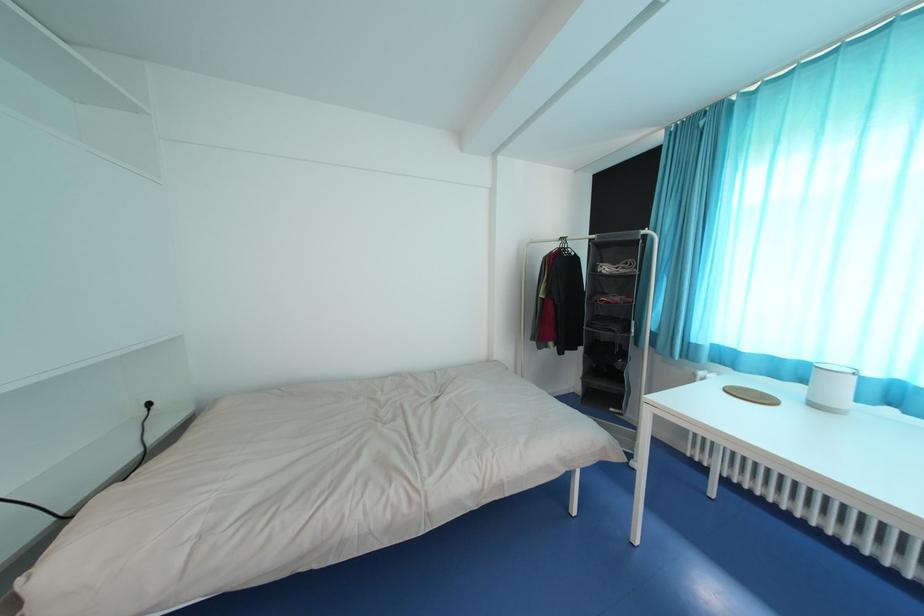
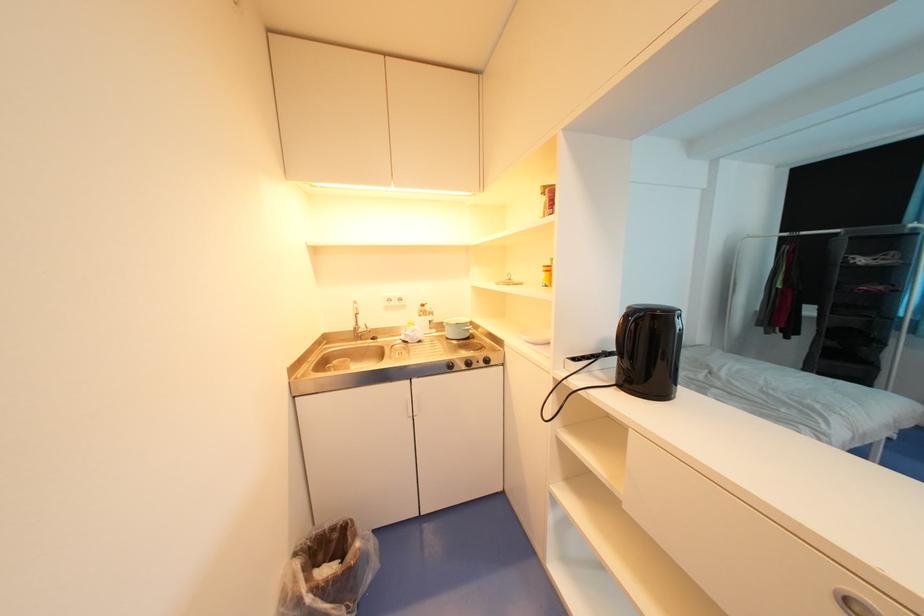
Question: Which direction would the cameraman need to move to produce the second image? Reply with the corresponding letter.

Choices:
 (A) Left
 (B) Right
 (C) Forward
 (D) Backward

Answer: (A)